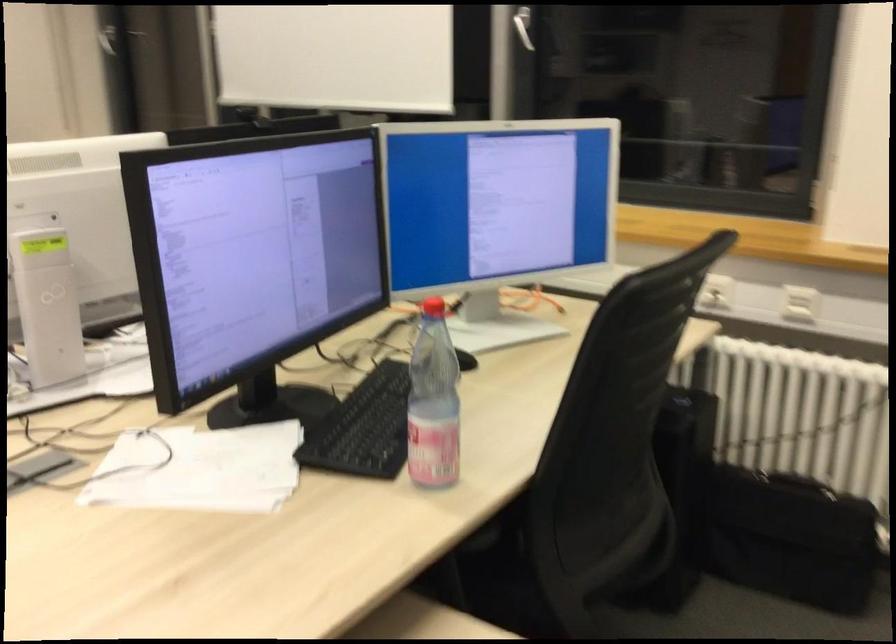
Describe the element at coordinates (503, 545) in the screenshot. This screenshot has width=896, height=644. I see `a chair sitting surface` at that location.